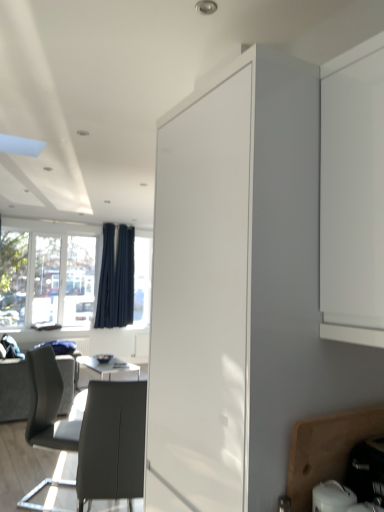
This screenshot has height=512, width=384. What do you see at coordinates (48, 404) in the screenshot? I see `matte gray chair at lower left, positioned as the first chair in back-to-front order` at bounding box center [48, 404].

At what (x,y) coordinates should I click in order to perform the action: click on matte gray chair at lower left, placed as the second chair when sorted from front to back. Please return your answer as a coordinate pair (x, y). Looking at the image, I should click on pos(48,404).

Measure the distance between point [299,487] and camera.

Point [299,487] and camera are 1.12 meters apart.

Where is `dark blue fabric curtain at left, arranged as the first curtain when viewed from the left`? The image size is (384, 512). dark blue fabric curtain at left, arranged as the first curtain when viewed from the left is located at coordinates (106, 281).

What do you see at coordinates (106, 281) in the screenshot?
I see `dark blue fabric curtain at left, arranged as the first curtain when viewed from the left` at bounding box center [106, 281].

This screenshot has height=512, width=384. Identify the location of dark gray fabric couch at lower left. (14, 390).

From the image's perspective, is dark blue fabric curtain at left, arranged as the 2th curtain when viewed from the left, located beneath wooden cutting board at lower right, placed as the second cabinetry when sorted from top to bottom?

Actually, dark blue fabric curtain at left, arranged as the 2th curtain when viewed from the left, appears above wooden cutting board at lower right, placed as the second cabinetry when sorted from top to bottom, in the image.

Is dark blue fabric curtain at left, arranged as the 2th curtain when viewed from the left, next to wooden cutting board at lower right, which is the first cabinetry from bottom to top, and touching it?

No, dark blue fabric curtain at left, arranged as the 2th curtain when viewed from the left, is not beside wooden cutting board at lower right, which is the first cabinetry from bottom to top.

Considering the relative sizes of dark blue fabric curtain at left, arranged as the 2th curtain when viewed from the left, and wooden cutting board at lower right, placed as the second cabinetry when sorted from top to bottom, in the image provided, is dark blue fabric curtain at left, arranged as the 2th curtain when viewed from the left, taller than wooden cutting board at lower right, placed as the second cabinetry when sorted from top to bottom,?

Correct, dark blue fabric curtain at left, arranged as the 2th curtain when viewed from the left, is much taller as wooden cutting board at lower right, placed as the second cabinetry when sorted from top to bottom.

Is matte gray chair at lower left, placed as the second chair when sorted from front to back, oriented towards transparent glass window at left?

No, matte gray chair at lower left, placed as the second chair when sorted from front to back, does not turn towards transparent glass window at left.

Is matte gray chair at lower left, positioned as the first chair in back-to-front order, shorter than transparent glass window at left?

Correct, matte gray chair at lower left, positioned as the first chair in back-to-front order, is not as tall as transparent glass window at left.

Looking at this image, is matte gray chair at lower left, positioned as the first chair in back-to-front order, wider or thinner than transparent glass window at left?

Considering their sizes, matte gray chair at lower left, positioned as the first chair in back-to-front order, looks broader than transparent glass window at left.

Does matte gray chair at lower left, placed as the second chair when sorted from front to back, lie in front of transparent glass window at left?

Yes, the depth of matte gray chair at lower left, placed as the second chair when sorted from front to back, is less than that of transparent glass window at left.

Would you consider dark blue fabric curtain at left, which is the second curtain in right-to-left order, to be distant from dark blue fabric curtain at left, which ranks as the 1th curtain in right-to-left order?

No, dark blue fabric curtain at left, which is the second curtain in right-to-left order, is not far away from dark blue fabric curtain at left, which ranks as the 1th curtain in right-to-left order.

Does point (98, 325) come in front of point (122, 238)?

Yes, point (98, 325) is closer to viewer.

Is dark blue fabric curtain at left, arranged as the first curtain when viewed from the left, to the left of dark blue fabric curtain at left, which ranks as the 1th curtain in right-to-left order, from the viewer's perspective?

Yes.

Could you measure the distance between wooden cutting board at lower right, placed as the second cabinetry when sorted from top to bottom, and white glossy cabinet at center, which is counted as the second cabinetry, starting from the bottom?

The distance of wooden cutting board at lower right, placed as the second cabinetry when sorted from top to bottom, from white glossy cabinet at center, which is counted as the second cabinetry, starting from the bottom, is 15.59 inches.

From a real-world perspective, is wooden cutting board at lower right, placed as the second cabinetry when sorted from top to bottom, above or below white glossy cabinet at center, which appears as the 1th cabinetry when viewed from the top?

wooden cutting board at lower right, placed as the second cabinetry when sorted from top to bottom, is situated lower than white glossy cabinet at center, which appears as the 1th cabinetry when viewed from the top, in the real world.

In the scene shown: Is wooden cutting board at lower right, which is the first cabinetry from bottom to top, at the left side of white glossy cabinet at center, which appears as the 1th cabinetry when viewed from the top?

Incorrect, wooden cutting board at lower right, which is the first cabinetry from bottom to top, is not on the left side of white glossy cabinet at center, which appears as the 1th cabinetry when viewed from the top.

Are wooden cutting board at lower right, which is the first cabinetry from bottom to top, and white glossy cabinet at center, which appears as the 1th cabinetry when viewed from the top, making contact?

No, wooden cutting board at lower right, which is the first cabinetry from bottom to top, is not beside white glossy cabinet at center, which appears as the 1th cabinetry when viewed from the top.

Is dark blue fabric curtain at left, which is the second curtain in right-to-left order, directly adjacent to dark gray fabric couch at lower left?

No, dark blue fabric curtain at left, which is the second curtain in right-to-left order, is not with dark gray fabric couch at lower left.

Considering the relative sizes of dark blue fabric curtain at left, which is the second curtain in right-to-left order, and dark gray fabric couch at lower left in the image provided, is dark blue fabric curtain at left, which is the second curtain in right-to-left order, wider than dark gray fabric couch at lower left?

Incorrect, the width of dark blue fabric curtain at left, which is the second curtain in right-to-left order, does not surpass that of dark gray fabric couch at lower left.

Does dark blue fabric curtain at left, arranged as the first curtain when viewed from the left, have a smaller size compared to dark gray fabric couch at lower left?

Indeed, dark blue fabric curtain at left, arranged as the first curtain when viewed from the left, has a smaller size compared to dark gray fabric couch at lower left.

From a real-world perspective, is transparent glass window at left on dark gray fabric couch at lower left?

Indeed, from a real-world perspective, transparent glass window at left stands above dark gray fabric couch at lower left.

Consider the image. Between transparent glass window at left and dark gray fabric couch at lower left, which one has more height?

transparent glass window at left.

In the image, there is a dark gray fabric couch at lower left. Where is `window above it (from the image's perspective)`? The width and height of the screenshot is (384, 512). window above it (from the image's perspective) is located at coordinates (48, 277).

Considering the positions of point (32, 282) and point (21, 405), is point (32, 282) closer or farther from the camera than point (21, 405)?

Point (32, 282).

Is dark blue fabric curtain at left, arranged as the first curtain when viewed from the left, smaller than white glossy cabinet at center, which appears as the 1th cabinetry when viewed from the top?

Yes, dark blue fabric curtain at left, arranged as the first curtain when viewed from the left, is smaller than white glossy cabinet at center, which appears as the 1th cabinetry when viewed from the top.

Based on the photo, is dark blue fabric curtain at left, arranged as the first curtain when viewed from the left, not near white glossy cabinet at center, which appears as the 1th cabinetry when viewed from the top?

Yes.

From the image's perspective, does dark blue fabric curtain at left, arranged as the first curtain when viewed from the left, appear lower than white glossy cabinet at center, which appears as the 1th cabinetry when viewed from the top?

Indeed, from the image's perspective, dark blue fabric curtain at left, arranged as the first curtain when viewed from the left, is shown beneath white glossy cabinet at center, which appears as the 1th cabinetry when viewed from the top.

Between dark blue fabric curtain at left, arranged as the first curtain when viewed from the left, and white glossy cabinet at center, which is counted as the second cabinetry, starting from the bottom, which one has more height?

dark blue fabric curtain at left, arranged as the first curtain when viewed from the left, is taller.

This screenshot has height=512, width=384. In order to click on curtain that is the 1st one when counting upward from the wooden cutting board at lower right, which is the first cabinetry from bottom to top (from the image's perspective) in this screenshot , I will do `click(124, 278)`.

There is a transparent glass window at left. Where is `the 2nd chair below it (from a real-world perspective)`? the 2nd chair below it (from a real-world perspective) is located at coordinates (48, 404).

Considering their positions, is dark blue fabric curtain at left, which ranks as the 1th curtain in right-to-left order, positioned further to wooden cutting board at lower right, placed as the second cabinetry when sorted from top to bottom, than transparent glass window at left?

dark blue fabric curtain at left, which ranks as the 1th curtain in right-to-left order, lies further to wooden cutting board at lower right, placed as the second cabinetry when sorted from top to bottom, than the other object.

Considering their positions, is dark blue fabric curtain at left, arranged as the 2th curtain when viewed from the left, positioned further to transparent glass window at left than matte gray chair at lower left, placed as the second chair when sorted from front to back?

The object further to transparent glass window at left is matte gray chair at lower left, placed as the second chair when sorted from front to back.

From the image, which object appears to be nearer to matte gray chair at lower left, the 1th chair in the front-to-back sequence, transparent glass window at left or wooden cutting board at lower right, which is the first cabinetry from bottom to top?

Based on the image, wooden cutting board at lower right, which is the first cabinetry from bottom to top, appears to be nearer to matte gray chair at lower left, the 1th chair in the front-to-back sequence.

Which object lies further to the anchor point transparent glass window at left, matte gray chair at lower left, placed as the second chair when sorted from back to front, or matte gray chair at lower left, positioned as the first chair in back-to-front order?

matte gray chair at lower left, placed as the second chair when sorted from back to front.

When comparing their distances from white glossy cabinet at center, which is counted as the second cabinetry, starting from the bottom, does dark blue fabric curtain at left, which is the second curtain in right-to-left order, or dark gray fabric couch at lower left seem closer?

The object closer to white glossy cabinet at center, which is counted as the second cabinetry, starting from the bottom, is dark gray fabric couch at lower left.

Based on their spatial positions, is dark blue fabric curtain at left, which ranks as the 1th curtain in right-to-left order, or white glossy cabinet at center, which is counted as the second cabinetry, starting from the bottom, further from dark blue fabric curtain at left, arranged as the first curtain when viewed from the left?

white glossy cabinet at center, which is counted as the second cabinetry, starting from the bottom.

Based on their spatial positions, is dark blue fabric curtain at left, which is the second curtain in right-to-left order, or dark blue fabric curtain at left, arranged as the 2th curtain when viewed from the left, closer to dark gray fabric couch at lower left?

Based on the image, dark blue fabric curtain at left, which is the second curtain in right-to-left order, appears to be nearer to dark gray fabric couch at lower left.

When comparing their distances from transparent glass window at left, does wooden cutting board at lower right, placed as the second cabinetry when sorted from top to bottom, or dark blue fabric curtain at left, arranged as the first curtain when viewed from the left, seem closer?

Based on the image, dark blue fabric curtain at left, arranged as the first curtain when viewed from the left, appears to be nearer to transparent glass window at left.

I want to click on curtain positioned between wooden cutting board at lower right, placed as the second cabinetry when sorted from top to bottom, and dark blue fabric curtain at left, arranged as the 2th curtain when viewed from the left, from near to far, so click(106, 281).

This screenshot has width=384, height=512. I want to click on cabinetry between white glossy cabinet at center, which appears as the 1th cabinetry when viewed from the top, and dark blue fabric curtain at left, which ranks as the 1th curtain in right-to-left order, along the z-axis, so click(x=327, y=449).

I want to click on cabinetry positioned between white glossy cabinet at center, which is counted as the second cabinetry, starting from the bottom, and matte gray chair at lower left, the 1th chair in the front-to-back sequence, from near to far, so click(x=327, y=449).

Identify the location of curtain positioned between white glossy cabinet at center, which is counted as the second cabinetry, starting from the bottom, and dark blue fabric curtain at left, arranged as the 2th curtain when viewed from the left, from near to far. Image resolution: width=384 pixels, height=512 pixels. (106, 281).